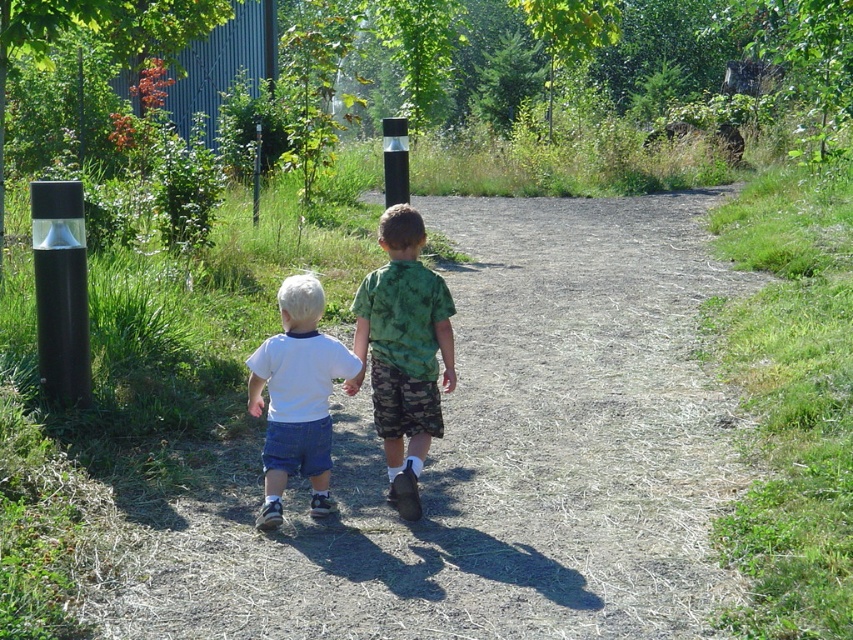
Question: Can you confirm if brown dirt path at center is positioned to the left of white cotton shirt at center?

Choices:
 (A) no
 (B) yes

Answer: (A)

Question: Is brown dirt path at center smaller than green camouflage shirt at center?

Choices:
 (A) yes
 (B) no

Answer: (B)

Question: Which point appears farthest from the camera in this image?

Choices:
 (A) (293, 403)
 (B) (387, 310)
 (C) (479, 579)

Answer: (B)

Question: Which object is closer to the camera taking this photo?

Choices:
 (A) green camouflage shirt at center
 (B) white cotton shirt at center

Answer: (B)

Question: Which of the following is the farthest from the observer?

Choices:
 (A) white cotton shirt at center
 (B) green camouflage shirt at center
 (C) brown dirt path at center

Answer: (B)

Question: Can you confirm if brown dirt path at center is positioned below white cotton shirt at center?

Choices:
 (A) no
 (B) yes

Answer: (A)